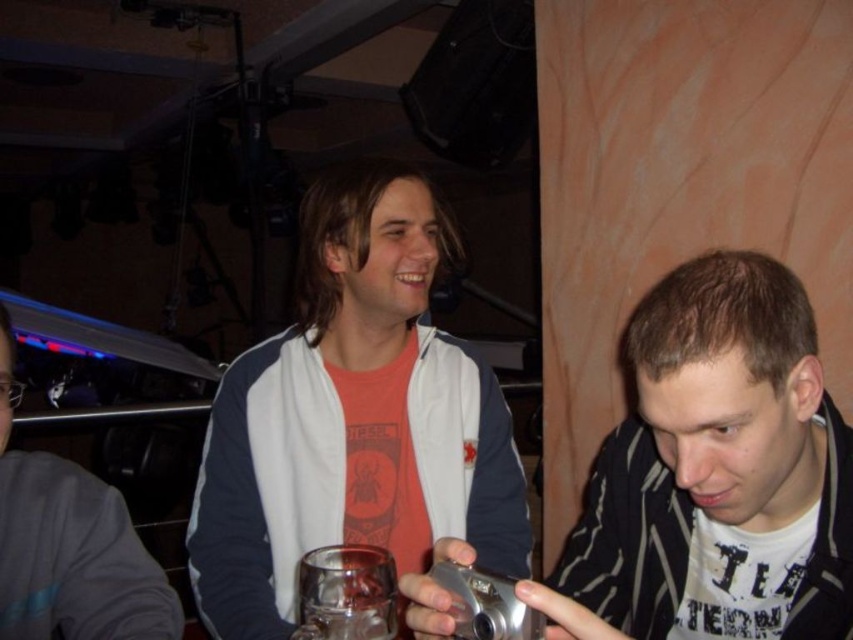
You are at a party and want to grab a drink. You see a white matte shirt at lower right and a translucent glass at center. Which object is closer to the ground?

The translucent glass at center is closer to the ground because the white matte shirt at lower right is above it.

You are a photographer at the event and want to take a photo of the white matte jacket at center and the brushed metal camera at center. Which object should you focus on first if you want to capture both in a single shot without moving the camera?

The white matte jacket at center is much taller than the brushed metal camera at center, so you should focus on the white matte jacket at center first to ensure it is in sharp focus before the camera adjusts for the smaller object.

Consider the image. You are a photographer at the event and need to take a photo of the white matte shirt at lower right without the brushed metal camera at center appearing in the background. Is this possible based on their current positions?

The white matte shirt at lower right is in front of the brushed metal camera at center, so taking a photo from the current angle would include the camera in the background. Adjust your position to frame the subject without the camera behind them.